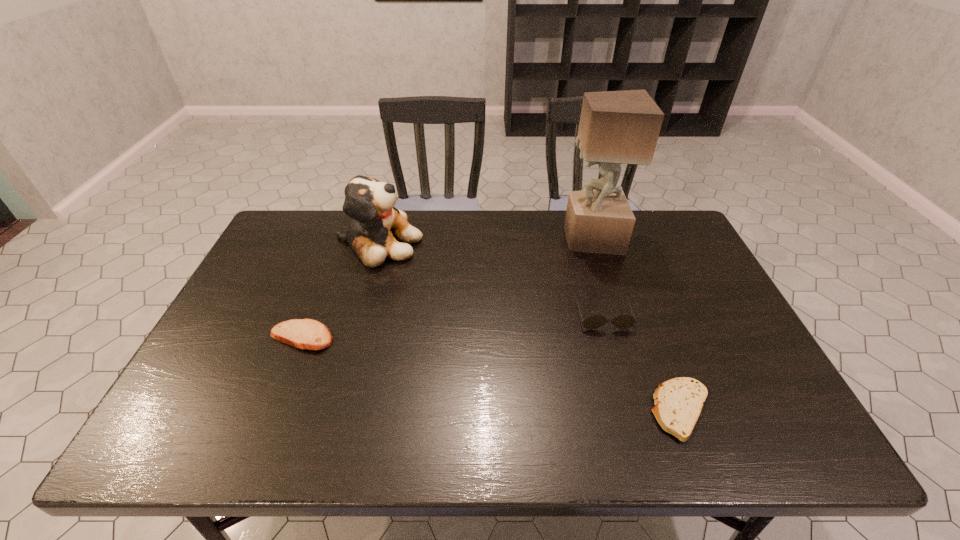
Where is `free space in the image that satisfies the following two spatial constraints: 1. on the front-facing side of the sunglasses; 2. on the right side of the shortest object`? This screenshot has width=960, height=540. free space in the image that satisfies the following two spatial constraints: 1. on the front-facing side of the sunglasses; 2. on the right side of the shortest object is located at coordinates (630, 410).

The image size is (960, 540). I want to click on free space that satisfies the following two spatial constraints: 1. on the back side of the nearest object; 2. on the front-facing side of the sculpture, so click(616, 239).

The width and height of the screenshot is (960, 540). In order to click on free location that satisfies the following two spatial constraints: 1. on the front-facing side of the sculpture; 2. on the front-facing side of the sunglasses in this screenshot , I will do `click(615, 315)`.